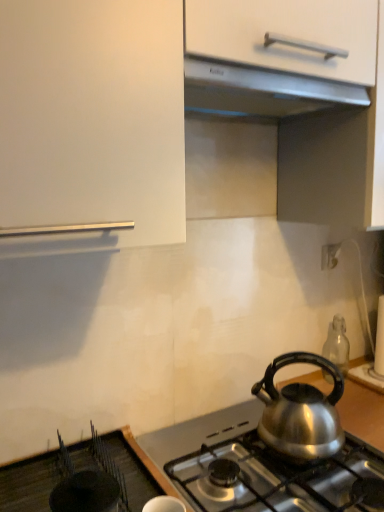
The height and width of the screenshot is (512, 384). What do you see at coordinates (261, 91) in the screenshot?
I see `satin silver exhaust hood at upper center` at bounding box center [261, 91].

Where is `shiny metallic kettle at lower right`? The height and width of the screenshot is (512, 384). shiny metallic kettle at lower right is located at coordinates (301, 412).

Image resolution: width=384 pixels, height=512 pixels. Describe the element at coordinates (330, 255) in the screenshot. I see `white plastic electric outlet at upper right` at that location.

You are a GUI agent. You are given a task and a screenshot of the screen. Output one action in this format:
    pyautogui.click(x=<x>, y=<y>)
    Task: Click on the transparent glass bottle at lower right
    This screenshot has width=384, height=512.
    Given the screenshot: What is the action you would take?
    pyautogui.click(x=337, y=344)

You are a GUI agent. You are given a task and a screenshot of the screen. Output one action in this format:
    pyautogui.click(x=<x>, y=<y>)
    Task: Click on the satin silver exhaust hood at upper center
    The height and width of the screenshot is (512, 384).
    Given the screenshot: What is the action you would take?
    pyautogui.click(x=261, y=91)

Is white plastic electric outlet at upper right situated inside satin silver gas stove at lower center or outside?

white plastic electric outlet at upper right is spatially situated outside satin silver gas stove at lower center.

Is white plastic electric outlet at upper right oriented towards satin silver gas stove at lower center?

No, white plastic electric outlet at upper right is not facing towards satin silver gas stove at lower center.

From the picture: Who is more distant, white plastic electric outlet at upper right or satin silver gas stove at lower center?

white plastic electric outlet at upper right is behind.

Does point (329, 351) appear closer or farther from the camera than point (372, 500)?

Point (329, 351) is positioned farther from the camera compared to point (372, 500).

Is there a large distance between transparent glass bottle at lower right and satin silver gas stove at lower center?

transparent glass bottle at lower right is near satin silver gas stove at lower center, not far away.

Where is `appliance above the satin silver gas stove at lower center (from the image's perspective)`? The image size is (384, 512). appliance above the satin silver gas stove at lower center (from the image's perspective) is located at coordinates (337, 344).

Considering the positions of objects transparent glass bottle at lower right and satin silver gas stove at lower center in the image provided, who is more to the left, transparent glass bottle at lower right or satin silver gas stove at lower center?

From the viewer's perspective, satin silver gas stove at lower center appears more on the left side.

Is white plastic electric outlet at upper right inside or outside of transparent glass bottle at lower right?

white plastic electric outlet at upper right is not enclosed by transparent glass bottle at lower right.

Is white plastic electric outlet at upper right aimed at transparent glass bottle at lower right?

No, white plastic electric outlet at upper right does not turn towards transparent glass bottle at lower right.

How many degrees apart are the facing directions of white plastic electric outlet at upper right and transparent glass bottle at lower right?

0.993 degrees separate the facing orientations of white plastic electric outlet at upper right and transparent glass bottle at lower right.

Between white plastic electric outlet at upper right and transparent glass bottle at lower right, which one appears on the left side from the viewer's perspective?

white plastic electric outlet at upper right is more to the left.

Looking at this image, between satin silver gas stove at lower center and white plastic electric outlet at upper right, which one appears on the left side from the viewer's perspective?

From the viewer's perspective, satin silver gas stove at lower center appears more on the left side.

From a real-world perspective, who is located higher, satin silver gas stove at lower center or white plastic electric outlet at upper right?

In real-world perspective, white plastic electric outlet at upper right is above.

From the picture: Can you see satin silver gas stove at lower center touching white plastic electric outlet at upper right?

No.

I want to click on exhaust hood above the white plastic electric outlet at upper right (from a real-world perspective), so click(261, 91).

Between point (336, 257) and point (318, 102), which one is positioned in front?

The point (318, 102) is in front.

From a real-world perspective, is white plastic electric outlet at upper right over satin silver exhaust hood at upper center?

No, from a real-world perspective, white plastic electric outlet at upper right is not on top of satin silver exhaust hood at upper center.

From the image's perspective, between white plastic electric outlet at upper right and satin silver exhaust hood at upper center, who is located below?

From the image's view, white plastic electric outlet at upper right is below.

Which object is positioned more to the right, shiny metallic kettle at lower right or satin silver gas stove at lower center?

shiny metallic kettle at lower right is more to the right.

Between shiny metallic kettle at lower right and satin silver gas stove at lower center, which one has less height?

With less height is satin silver gas stove at lower center.

Which object is further away from the camera, shiny metallic kettle at lower right or satin silver gas stove at lower center?

shiny metallic kettle at lower right is further from the camera.

Which object is thinner, shiny metallic kettle at lower right or satin silver gas stove at lower center?

Thinner between the two is shiny metallic kettle at lower right.

Would you consider satin silver gas stove at lower center to be distant from shiny metallic kettle at lower right?

No.

You are a GUI agent. You are given a task and a screenshot of the screen. Output one action in this format:
    pyautogui.click(x=<x>, y=<y>)
    Task: Click on the kettle above the satin silver gas stove at lower center (from the image's perspective)
    The height and width of the screenshot is (512, 384).
    Given the screenshot: What is the action you would take?
    pyautogui.click(x=301, y=412)

Considering the sizes of objects satin silver gas stove at lower center and shiny metallic kettle at lower right in the image provided, who is bigger, satin silver gas stove at lower center or shiny metallic kettle at lower right?

Bigger between the two is satin silver gas stove at lower center.

Between satin silver gas stove at lower center and shiny metallic kettle at lower right, which one appears on the left side from the viewer's perspective?

From the viewer's perspective, satin silver gas stove at lower center appears more on the left side.

The image size is (384, 512). Identify the location of electric outlet behind the satin silver gas stove at lower center. (330, 255).

This screenshot has height=512, width=384. I want to click on appliance lying on the right of satin silver gas stove at lower center, so click(337, 344).

Consider the image. Which object lies further to the anchor point transparent glass bottle at lower right, shiny metallic kettle at lower right or satin silver gas stove at lower center?

satin silver gas stove at lower center.

Which object lies further to the anchor point white plastic electric outlet at upper right, shiny metallic kettle at lower right or transparent glass bottle at lower right?

The object further to white plastic electric outlet at upper right is shiny metallic kettle at lower right.

Considering their positions, is transparent glass bottle at lower right positioned further to white plastic electric outlet at upper right than satin silver exhaust hood at upper center?

satin silver exhaust hood at upper center lies further to white plastic electric outlet at upper right than the other object.

Looking at the image, which one is located closer to white plastic electric outlet at upper right, transparent glass bottle at lower right or shiny metallic kettle at lower right?

Among the two, transparent glass bottle at lower right is located nearer to white plastic electric outlet at upper right.

When comparing their distances from transparent glass bottle at lower right, does satin silver exhaust hood at upper center or satin silver gas stove at lower center seem closer?

The object closer to transparent glass bottle at lower right is satin silver gas stove at lower center.

Based on their spatial positions, is shiny metallic kettle at lower right or satin silver gas stove at lower center further from white plastic electric outlet at upper right?

satin silver gas stove at lower center lies further to white plastic electric outlet at upper right than the other object.

From the picture: Looking at the image, which one is located further to shiny metallic kettle at lower right, white plastic electric outlet at upper right or transparent glass bottle at lower right?

white plastic electric outlet at upper right.

Estimate the real-world distances between objects in this image. Which object is closer to transparent glass bottle at lower right, white plastic electric outlet at upper right or shiny metallic kettle at lower right?

white plastic electric outlet at upper right lies closer to transparent glass bottle at lower right than the other object.

Identify the location of appliance between satin silver exhaust hood at upper center and satin silver gas stove at lower center from top to bottom. The width and height of the screenshot is (384, 512). (337, 344).

Find the location of `appliance positioned between shiny metallic kettle at lower right and white plastic electric outlet at upper right from near to far`. appliance positioned between shiny metallic kettle at lower right and white plastic electric outlet at upper right from near to far is located at coordinates (337, 344).

At what (x,y) coordinates should I click in order to perform the action: click on appliance between satin silver exhaust hood at upper center and white plastic electric outlet at upper right in the front-back direction. Please return your answer as a coordinate pair (x, y). Looking at the image, I should click on (337, 344).

Identify the location of appliance located between satin silver gas stove at lower center and white plastic electric outlet at upper right in the depth direction. The height and width of the screenshot is (512, 384). (337, 344).